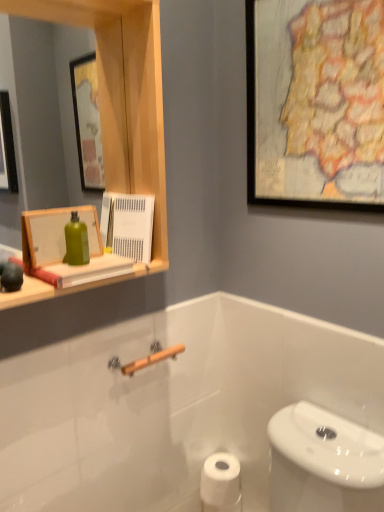
Image resolution: width=384 pixels, height=512 pixels. Find the location of `wooden picture frame at upper left, which is the 1th picture frame in left-to-right order`. wooden picture frame at upper left, which is the 1th picture frame in left-to-right order is located at coordinates (55, 234).

Describe the element at coordinates (55, 234) in the screenshot. The height and width of the screenshot is (512, 384). I see `wooden picture frame at upper left, positioned as the 1th picture frame in bottom-to-top order` at that location.

Describe the element at coordinates (221, 483) in the screenshot. I see `white matte toilet paper at lower center` at that location.

This screenshot has width=384, height=512. Identify the location of white matte toilet paper at lower center. (221, 483).

Locate an element on the screen. The image size is (384, 512). wooden picture frame at upper left, acting as the second picture frame starting from the top is located at coordinates (55, 234).

From the image's perspective, is wooden framed map at upper right, the first picture frame viewed from the right, above or below white matte toilet paper at lower center?

From the image's perspective, wooden framed map at upper right, the first picture frame viewed from the right, appears above white matte toilet paper at lower center.

Would you say wooden framed map at upper right, the first picture frame viewed from the right, is inside or outside white matte toilet paper at lower center?

wooden framed map at upper right, the first picture frame viewed from the right, is outside white matte toilet paper at lower center.

Between wooden framed map at upper right, positioned as the second picture frame in bottom-to-top order, and white matte toilet paper at lower center, which one has smaller size?

With smaller size is white matte toilet paper at lower center.

The width and height of the screenshot is (384, 512). Identify the location of picture frame on the right of white matte toilet paper at lower center. click(x=315, y=103).

Is wooden framed map at upper right, the first picture frame viewed from the right, aimed at wooden picture frame at upper left, which is the 1th picture frame in left-to-right order?

Yes.

Which object is more forward, wooden framed map at upper right, positioned as the second picture frame in bottom-to-top order, or wooden picture frame at upper left, positioned as the 1th picture frame in bottom-to-top order?

wooden framed map at upper right, positioned as the second picture frame in bottom-to-top order, is in front.

Do you think wooden framed map at upper right, which ranks as the first picture frame in top-to-bottom order, is within wooden picture frame at upper left, acting as the second picture frame starting from the top, or outside of it?

wooden framed map at upper right, which ranks as the first picture frame in top-to-bottom order, is outside wooden picture frame at upper left, acting as the second picture frame starting from the top.

The width and height of the screenshot is (384, 512). Identify the location of picture frame that is above the wooden picture frame at upper left, which is the 1th picture frame in left-to-right order (from the image's perspective). click(315, 103).

Does point (214, 471) appear closer or farther from the camera than point (295, 65)?

Clearly, point (214, 471) is more distant from the camera than point (295, 65).

Between white matte toilet paper at lower center and wooden framed map at upper right, which ranks as the first picture frame in top-to-bottom order, which one has more height?

Standing taller between the two is wooden framed map at upper right, which ranks as the first picture frame in top-to-bottom order.

Are white matte toilet paper at lower center and wooden framed map at upper right, positioned as the second picture frame in bottom-to-top order, far apart?

Yes, white matte toilet paper at lower center and wooden framed map at upper right, positioned as the second picture frame in bottom-to-top order, are located far from each other.

From the image's perspective, which is below, white matte toilet paper at lower center or wooden framed map at upper right, positioned as the second picture frame in bottom-to-top order?

white matte toilet paper at lower center appears lower in the image.

Considering the relative positions of wooden medicine cabinet at upper left and wooden picture frame at upper left, positioned as the 1th picture frame in bottom-to-top order, in the image provided, is wooden medicine cabinet at upper left to the left of wooden picture frame at upper left, positioned as the 1th picture frame in bottom-to-top order, from the viewer's perspective?

In fact, wooden medicine cabinet at upper left is to the right of wooden picture frame at upper left, positioned as the 1th picture frame in bottom-to-top order.

Is wooden picture frame at upper left, the second picture frame when ordered from right to left, at the back of wooden medicine cabinet at upper left?

Yes, wooden medicine cabinet at upper left's orientation is away from wooden picture frame at upper left, the second picture frame when ordered from right to left.

Who is taller, wooden medicine cabinet at upper left or wooden picture frame at upper left, positioned as the 1th picture frame in bottom-to-top order?

wooden medicine cabinet at upper left is taller.

Is wooden medicine cabinet at upper left wider or thinner than wooden picture frame at upper left, the second picture frame when ordered from right to left?

wooden medicine cabinet at upper left is wider than wooden picture frame at upper left, the second picture frame when ordered from right to left.

How many degrees apart are the facing directions of wooden picture frame at upper left, which is the 1th picture frame in left-to-right order, and wooden medicine cabinet at upper left?

The angle between the facing direction of wooden picture frame at upper left, which is the 1th picture frame in left-to-right order, and the facing direction of wooden medicine cabinet at upper left is 0.805 degrees.

Based on the photo, considering the sizes of objects wooden picture frame at upper left, positioned as the 1th picture frame in bottom-to-top order, and wooden medicine cabinet at upper left in the image provided, who is wider, wooden picture frame at upper left, positioned as the 1th picture frame in bottom-to-top order, or wooden medicine cabinet at upper left?

wooden medicine cabinet at upper left is wider.

Does wooden picture frame at upper left, which is the 1th picture frame in left-to-right order, appear on the right side of wooden medicine cabinet at upper left?

No, wooden picture frame at upper left, which is the 1th picture frame in left-to-right order, is not to the right of wooden medicine cabinet at upper left.

Does wooden picture frame at upper left, acting as the second picture frame starting from the top, turn towards wooden medicine cabinet at upper left?

Yes, wooden picture frame at upper left, acting as the second picture frame starting from the top, is aimed at wooden medicine cabinet at upper left.

Between white matte toilet paper at lower center and wooden picture frame at upper left, which is the 1th picture frame in left-to-right order, which one has larger width?

white matte toilet paper at lower center is wider.

Find the location of a particular element. toilet paper on the right of wooden picture frame at upper left, positioned as the 1th picture frame in bottom-to-top order is located at coordinates (221, 483).

In the scene shown: Does white matte toilet paper at lower center have a lesser height compared to wooden picture frame at upper left, which is the 1th picture frame in left-to-right order?

Yes, white matte toilet paper at lower center is shorter than wooden picture frame at upper left, which is the 1th picture frame in left-to-right order.

Is white matte toilet paper at lower center facing towards wooden picture frame at upper left, the second picture frame when ordered from right to left?

No, white matte toilet paper at lower center is not turned towards wooden picture frame at upper left, the second picture frame when ordered from right to left.

Is wooden picture frame at upper left, which is the 1th picture frame in left-to-right order, thinner than white matte toilet paper at lower center?

Yes.

Considering the relative positions of wooden picture frame at upper left, acting as the second picture frame starting from the top, and white matte toilet paper at lower center in the image provided, is wooden picture frame at upper left, acting as the second picture frame starting from the top, to the left of white matte toilet paper at lower center from the viewer's perspective?

Yes, wooden picture frame at upper left, acting as the second picture frame starting from the top, is to the left of white matte toilet paper at lower center.

Is point (69, 207) in front of point (215, 495)?

That is False.

Can you confirm if wooden picture frame at upper left, which is the 1th picture frame in left-to-right order, is bigger than white matte toilet paper at lower center?

No, wooden picture frame at upper left, which is the 1th picture frame in left-to-right order, is not bigger than white matte toilet paper at lower center.

Find the location of a particular element. toilet paper behind the wooden framed map at upper right, the first picture frame viewed from the right is located at coordinates (221, 483).

What are the coordinates of `picture frame that is in front of the wooden picture frame at upper left, acting as the second picture frame starting from the top` in the screenshot? It's located at (315, 103).

Based on their spatial positions, is wooden framed map at upper right, the second picture frame positioned from the left, or wooden picture frame at upper left, acting as the second picture frame starting from the top, further from wooden medicine cabinet at upper left?

Among the two, wooden framed map at upper right, the second picture frame positioned from the left, is located further to wooden medicine cabinet at upper left.

When comparing their distances from white matte toilet paper at lower center, does wooden medicine cabinet at upper left or wooden picture frame at upper left, positioned as the 1th picture frame in bottom-to-top order, seem closer?

Among the two, wooden picture frame at upper left, positioned as the 1th picture frame in bottom-to-top order, is located nearer to white matte toilet paper at lower center.

Considering their positions, is wooden picture frame at upper left, positioned as the 1th picture frame in bottom-to-top order, positioned closer to wooden framed map at upper right, which ranks as the first picture frame in top-to-bottom order, than white matte toilet paper at lower center?

wooden picture frame at upper left, positioned as the 1th picture frame in bottom-to-top order, is positioned closer to the anchor wooden framed map at upper right, which ranks as the first picture frame in top-to-bottom order.

Which object lies further to the anchor point wooden picture frame at upper left, positioned as the 1th picture frame in bottom-to-top order, wooden framed map at upper right, which ranks as the first picture frame in top-to-bottom order, or white matte toilet paper at lower center?

white matte toilet paper at lower center is positioned further to the anchor wooden picture frame at upper left, positioned as the 1th picture frame in bottom-to-top order.

Estimate the real-world distances between objects in this image. Which object is further from white matte toilet paper at lower center, wooden framed map at upper right, the second picture frame positioned from the left, or wooden medicine cabinet at upper left?

wooden framed map at upper right, the second picture frame positioned from the left, lies further to white matte toilet paper at lower center than the other object.

Considering their positions, is wooden picture frame at upper left, positioned as the 1th picture frame in bottom-to-top order, positioned closer to wooden medicine cabinet at upper left than white matte toilet paper at lower center?

wooden picture frame at upper left, positioned as the 1th picture frame in bottom-to-top order.

From the picture: Which object lies further to the anchor point white matte toilet paper at lower center, wooden picture frame at upper left, positioned as the 1th picture frame in bottom-to-top order, or wooden framed map at upper right, which ranks as the first picture frame in top-to-bottom order?

wooden framed map at upper right, which ranks as the first picture frame in top-to-bottom order, is positioned further to the anchor white matte toilet paper at lower center.

When comparing their distances from wooden picture frame at upper left, which is the 1th picture frame in left-to-right order, does wooden framed map at upper right, positioned as the second picture frame in bottom-to-top order, or wooden medicine cabinet at upper left seem closer?

Based on the image, wooden medicine cabinet at upper left appears to be nearer to wooden picture frame at upper left, which is the 1th picture frame in left-to-right order.

Locate an element on the screen. Image resolution: width=384 pixels, height=512 pixels. picture frame that lies between wooden framed map at upper right, which ranks as the first picture frame in top-to-bottom order, and white matte toilet paper at lower center from top to bottom is located at coordinates (55, 234).

This screenshot has height=512, width=384. I want to click on medicine cabinet between wooden picture frame at upper left, the second picture frame when ordered from right to left, and wooden framed map at upper right, the first picture frame viewed from the right, from left to right, so click(x=117, y=111).

In order to click on medicine cabinet between wooden framed map at upper right, which ranks as the first picture frame in top-to-bottom order, and white matte toilet paper at lower center, in the vertical direction in this screenshot , I will do [117, 111].

Locate an element on the screen. picture frame between wooden medicine cabinet at upper left and white matte toilet paper at lower center in the vertical direction is located at coordinates (55, 234).